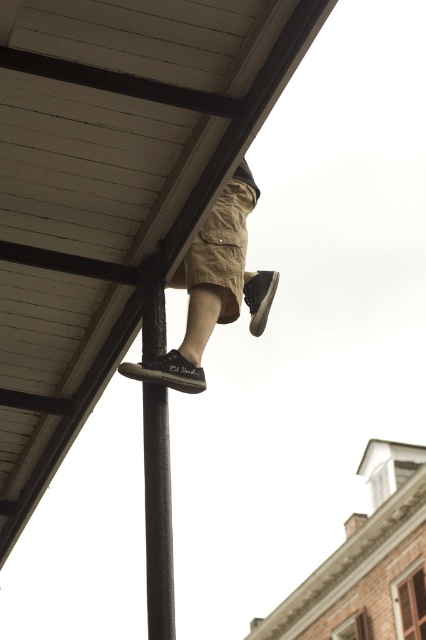
Based on the scene, where is the wooden roof at upper center located in terms of coordinates?

The wooden roof at upper center is located at point coordinates of (111, 186).